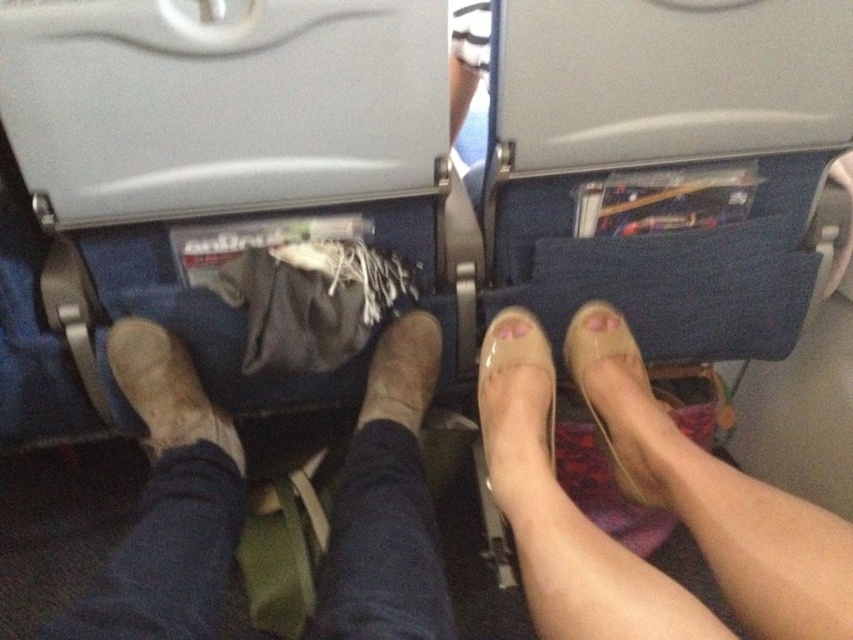
The height and width of the screenshot is (640, 853). What do you see at coordinates (718, 500) in the screenshot? I see `clear plastic shoes at center` at bounding box center [718, 500].

Which is above, clear plastic shoes at center or leather boot at left?

leather boot at left is above.

Measure the distance between clear plastic shoes at center and camera.

They are 17.17 inches apart.

Where is `clear plastic shoes at center`? Image resolution: width=853 pixels, height=640 pixels. clear plastic shoes at center is located at coordinates (718, 500).

Where is `leather boot at left`? This screenshot has height=640, width=853. leather boot at left is located at coordinates (166, 388).

Is leather boot at left to the left of matte beige toe at center from the viewer's perspective?

Yes, leather boot at left is to the left of matte beige toe at center.

The height and width of the screenshot is (640, 853). What do you see at coordinates (166, 388) in the screenshot? I see `leather boot at left` at bounding box center [166, 388].

The width and height of the screenshot is (853, 640). I want to click on leather boot at left, so click(166, 388).

Does clear plastic shoes at center have a smaller size compared to pink glossy toe at center?

Incorrect, clear plastic shoes at center is not smaller in size than pink glossy toe at center.

Which is in front, point (711, 627) or point (521, 323)?

Positioned in front is point (711, 627).

What do you see at coordinates (718, 500) in the screenshot? I see `clear plastic shoes at center` at bounding box center [718, 500].

At what (x,y) coordinates should I click in order to perform the action: click on clear plastic shoes at center. Please return your answer as a coordinate pair (x, y). This screenshot has height=640, width=853. Looking at the image, I should click on (718, 500).